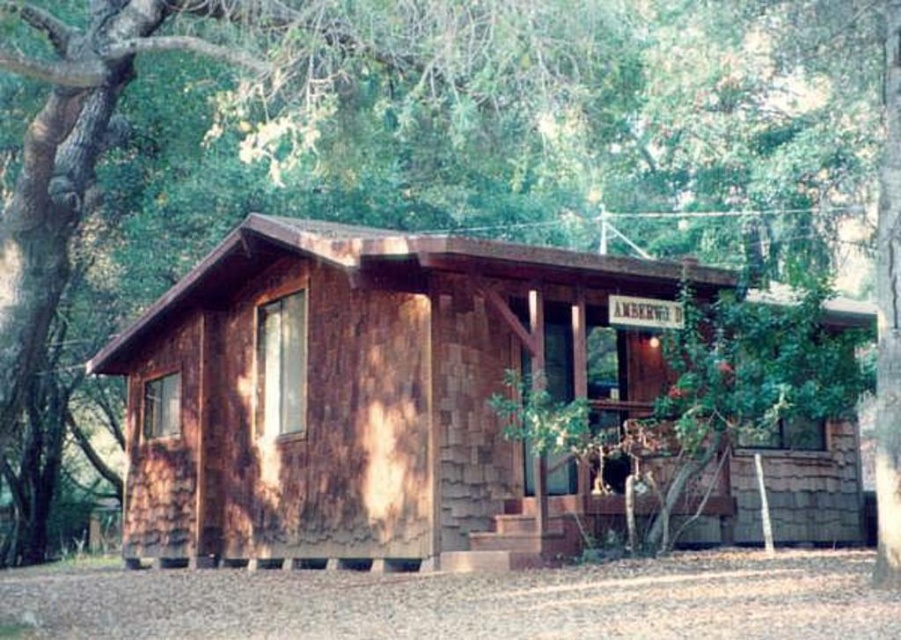
You are standing in front of the weathered wood cabin at center and looking towards the green leafy tree at upper center. Which object appears bigger to you?

The green leafy tree at upper center appears bigger than the weathered wood cabin at center because it is larger in size.

You are standing at the edge of the woods and want to reach the weathered wood cabin at center without getting too close to the green leafy tree at upper center. What is the minimum distance you need to maintain from the tree to safely reach the cabin?

The green leafy tree at upper center is 5.10 feet away from the weathered wood cabin at center, so you need to maintain a minimum distance of 5.10 feet from the tree to safely reach the cabin without getting too close.